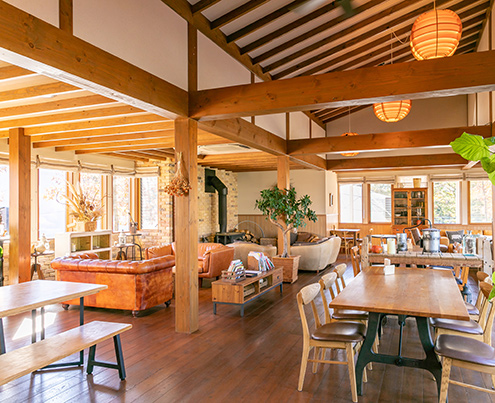
At what (x,y) coordinates should I click in order to perform the action: click on left windows. Please return your answer as a coordinate pair (x, y). Looking at the image, I should click on (56, 218), (98, 189), (120, 189), (149, 203).